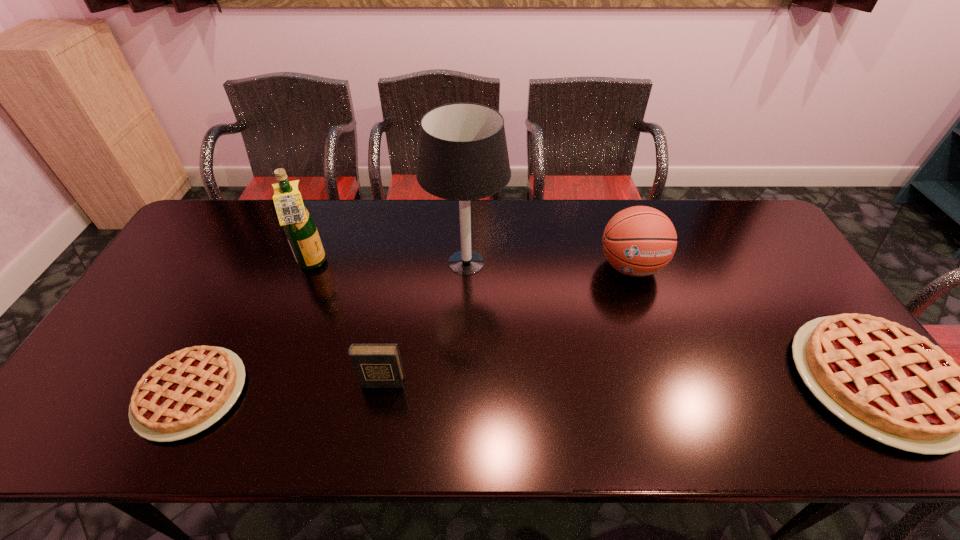
The image size is (960, 540). I want to click on free space at the far edge, so click(444, 233).

Image resolution: width=960 pixels, height=540 pixels. What are the coordinates of `vacant space at the near edge` in the screenshot? It's located at (797, 377).

In the image, there is a desktop. Where is `vacant space at the left edge`? vacant space at the left edge is located at coordinates (149, 299).

This screenshot has width=960, height=540. Find the location of `vacant space at the right edge`. vacant space at the right edge is located at coordinates (750, 280).

At what (x,y) coordinates should I click in order to perform the action: click on vacant space at the far right corner of the desktop. Please return your answer as a coordinate pair (x, y). Looking at the image, I should click on [x=707, y=200].

You are a GUI agent. You are given a task and a screenshot of the screen. Output one action in this format:
    pyautogui.click(x=<x>, y=<y>)
    Task: Click on the vacant space in between the tallest object and the third object from left to right
    
    Given the screenshot: What is the action you would take?
    click(x=424, y=322)

At what (x,y) coordinates should I click in order to perform the action: click on free space between the third object from right to left and the shortest object. Please return your answer as a coordinate pair (x, y). Looking at the image, I should click on (329, 328).

Where is `empty space between the tallest object and the leftmost object`? This screenshot has width=960, height=540. empty space between the tallest object and the leftmost object is located at coordinates click(329, 328).

Locate an element on the screen. empty space between the third object from left to right and the table lamp is located at coordinates (424, 322).

Find the location of a particular element. free spot between the third tallest object and the fourth object from right to left is located at coordinates (506, 325).